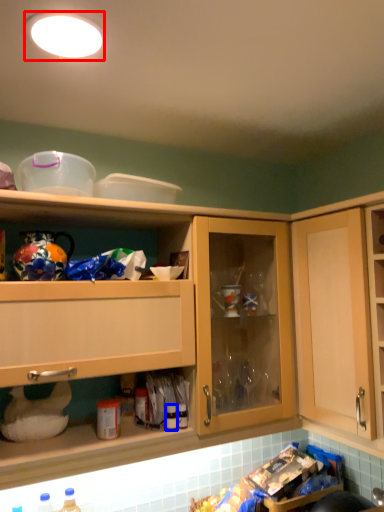
Question: Which of the following is the farthest to the observer, lighting (highlighted by a red box) or bottle (highlighted by a blue box)?

Choices:
 (A) lighting
 (B) bottle

Answer: (B)